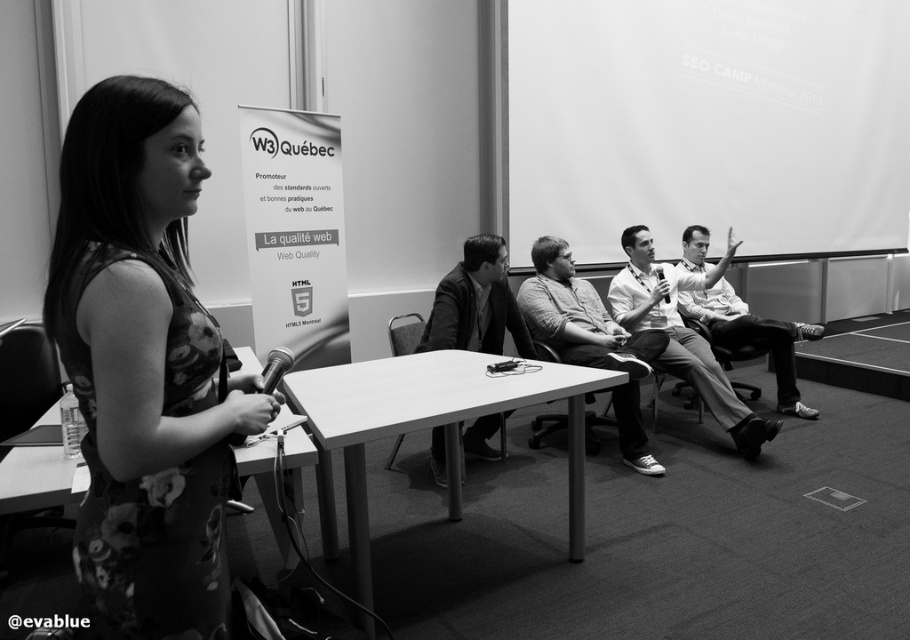
Is point (9, 477) closer to viewer compared to point (776, 346)?

Yes, point (9, 477) is in front of point (776, 346).

Who is more forward, (x=18, y=461) or (x=804, y=326)?

Point (x=18, y=461) is in front.

Identify the location of smooth wooden table at center. The height and width of the screenshot is (640, 910). (38, 480).

Between matte gray shirt at center and metallic microphone at table left, which one appears on the left side from the viewer's perspective?

metallic microphone at table left

Which is above, matte gray shirt at center or metallic microphone at table left?

metallic microphone at table left is higher up.

The width and height of the screenshot is (910, 640). Find the location of `matte gray shirt at center`. matte gray shirt at center is located at coordinates (590, 339).

Does point (521, 314) lie in front of point (664, 298)?

That is True.

Does matte gray shirt at center have a greater height compared to metallic silver microphone at center?

Yes.

Describe the element at coordinates (590, 339) in the screenshot. I see `matte gray shirt at center` at that location.

I want to click on matte gray shirt at center, so click(x=590, y=339).